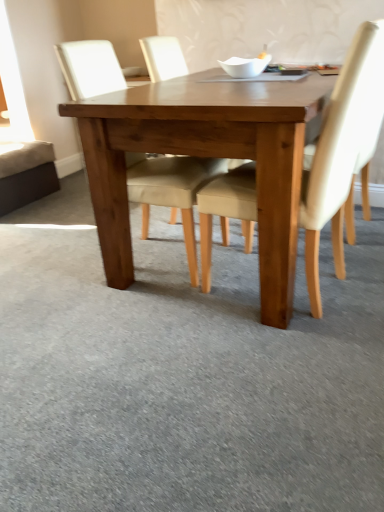
Question: Considering the relative sizes of beige fabric chair at center, which is the first chair in left-to-right order, and light brown wooden table at center in the image provided, is beige fabric chair at center, which is the first chair in left-to-right order, taller than light brown wooden table at center?

Choices:
 (A) yes
 (B) no

Answer: (A)

Question: Can you confirm if beige fabric chair at center, the second chair positioned from the right, is wider than light brown wooden table at center?

Choices:
 (A) yes
 (B) no

Answer: (B)

Question: Does beige fabric chair at center, the second chair positioned from the right, appear on the right side of light brown wooden table at center?

Choices:
 (A) yes
 (B) no

Answer: (B)

Question: Does beige fabric chair at center, the second chair positioned from the right, lie in front of light brown wooden table at center?

Choices:
 (A) yes
 (B) no

Answer: (B)

Question: Is beige fabric chair at center, the second chair positioned from the right, thinner than light brown wooden table at center?

Choices:
 (A) yes
 (B) no

Answer: (A)

Question: From a real-world perspective, is light beige fabric chair at center, the first chair when ordered from right to left, positioned under beige fabric chair at center, which is the first chair in left-to-right order, based on gravity?

Choices:
 (A) no
 (B) yes

Answer: (B)

Question: Considering the relative positions of light beige fabric chair at center, positioned as the 2th chair in left-to-right order, and beige fabric chair at center, which is the first chair in left-to-right order, in the image provided, is light beige fabric chair at center, positioned as the 2th chair in left-to-right order, behind beige fabric chair at center, which is the first chair in left-to-right order,?

Choices:
 (A) yes
 (B) no

Answer: (B)

Question: From the image's perspective, is light beige fabric chair at center, the first chair when ordered from right to left, below beige fabric chair at center, the second chair positioned from the right?

Choices:
 (A) yes
 (B) no

Answer: (A)

Question: Is light beige fabric chair at center, the first chair when ordered from right to left, facing away from beige fabric chair at center, the second chair positioned from the right?

Choices:
 (A) no
 (B) yes

Answer: (A)

Question: From the image's perspective, is light beige fabric chair at center, the first chair when ordered from right to left, located above beige fabric chair at center, which is the first chair in left-to-right order?

Choices:
 (A) yes
 (B) no

Answer: (B)

Question: Can you confirm if light beige fabric chair at center, the first chair when ordered from right to left, is bigger than beige fabric chair at center, the second chair positioned from the right?

Choices:
 (A) yes
 (B) no

Answer: (B)

Question: Can you confirm if light brown wooden table at center is smaller than beige fabric chair at center, which is the first chair in left-to-right order?

Choices:
 (A) no
 (B) yes

Answer: (A)